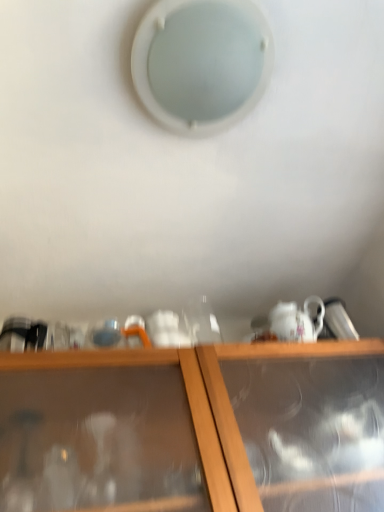
This screenshot has width=384, height=512. Describe the element at coordinates (169, 423) in the screenshot. I see `wooden cabinet at lower center` at that location.

Identify the location of wooden cabinet at lower center. (169, 423).

The image size is (384, 512). Describe the element at coordinates (201, 63) in the screenshot. I see `white frosted glass hole at upper center` at that location.

Find the location of a particular element. white frosted glass hole at upper center is located at coordinates (201, 63).

This screenshot has height=512, width=384. What are the coordinates of `wooden cabinet at lower center` in the screenshot? It's located at (169, 423).

Does white frosted glass hole at upper center appear on the right side of wooden cabinet at lower center?

No, white frosted glass hole at upper center is not to the right of wooden cabinet at lower center.

Which is in front, white frosted glass hole at upper center or wooden cabinet at lower center?

wooden cabinet at lower center is closer to the camera.

Which point is more distant from viewer, (178, 8) or (103, 418)?

Positioned behind is point (103, 418).

From the image's perspective, is white frosted glass hole at upper center positioned above or below wooden cabinet at lower center?

Clearly, from the image's perspective, white frosted glass hole at upper center is above wooden cabinet at lower center.

From a real-world perspective, is white frosted glass hole at upper center physically above wooden cabinet at lower center?

Yes, from a real-world perspective, white frosted glass hole at upper center is above wooden cabinet at lower center.

Does white frosted glass hole at upper center have a lesser width compared to wooden cabinet at lower center?

Correct, the width of white frosted glass hole at upper center is less than that of wooden cabinet at lower center.

Who is taller, white frosted glass hole at upper center or wooden cabinet at lower center?

Standing taller between the two is wooden cabinet at lower center.

From the picture: Who is smaller, white frosted glass hole at upper center or wooden cabinet at lower center?

With smaller size is white frosted glass hole at upper center.

Is white frosted glass hole at upper center spatially inside wooden cabinet at lower center, or outside of it?

white frosted glass hole at upper center is outside wooden cabinet at lower center.

Is the surface of white frosted glass hole at upper center in direct contact with wooden cabinet at lower center?

No, white frosted glass hole at upper center is not making contact with wooden cabinet at lower center.

Does white frosted glass hole at upper center turn towards wooden cabinet at lower center?

No.

How distant is white frosted glass hole at upper center from wooden cabinet at lower center?

They are 63.76 centimeters apart.

The image size is (384, 512). In order to click on hole on the left of wooden cabinet at lower center in this screenshot , I will do `click(201, 63)`.

Visually, is wooden cabinet at lower center positioned to the left or to the right of white frosted glass hole at upper center?

From the image, it's evident that wooden cabinet at lower center is to the right of white frosted glass hole at upper center.

Which is behind, wooden cabinet at lower center or white frosted glass hole at upper center?

white frosted glass hole at upper center.

Is point (184, 415) closer or farther from the camera than point (170, 0)?

Point (184, 415) is positioned farther from the camera compared to point (170, 0).

From the image's perspective, does wooden cabinet at lower center appear lower than white frosted glass hole at upper center?

Yes.

From a real-world perspective, who is located lower, wooden cabinet at lower center or white frosted glass hole at upper center?

wooden cabinet at lower center.

Is wooden cabinet at lower center wider than white frosted glass hole at upper center?

Indeed, wooden cabinet at lower center has a greater width compared to white frosted glass hole at upper center.

Can you confirm if wooden cabinet at lower center is taller than white frosted glass hole at upper center?

Yes, wooden cabinet at lower center is taller than white frosted glass hole at upper center.

Looking at the image, does wooden cabinet at lower center seem bigger or smaller compared to white frosted glass hole at upper center?

Clearly, wooden cabinet at lower center is larger in size than white frosted glass hole at upper center.

Based on the photo, which is correct: wooden cabinet at lower center is inside white frosted glass hole at upper center, or outside of it?

The correct answer is: outside.

Are wooden cabinet at lower center and white frosted glass hole at upper center far apart?

Actually, wooden cabinet at lower center and white frosted glass hole at upper center are a little close together.

Is wooden cabinet at lower center facing towards white frosted glass hole at upper center?

No, wooden cabinet at lower center is not turned towards white frosted glass hole at upper center.

The width and height of the screenshot is (384, 512). I want to click on hole on the left of wooden cabinet at lower center, so click(201, 63).

Where is `shelf that appears below the white frosted glass hole at upper center (from a real-world perspective)`? This screenshot has height=512, width=384. shelf that appears below the white frosted glass hole at upper center (from a real-world perspective) is located at coordinates (169, 423).

Identify the location of shelf in front of the white frosted glass hole at upper center. (169, 423).